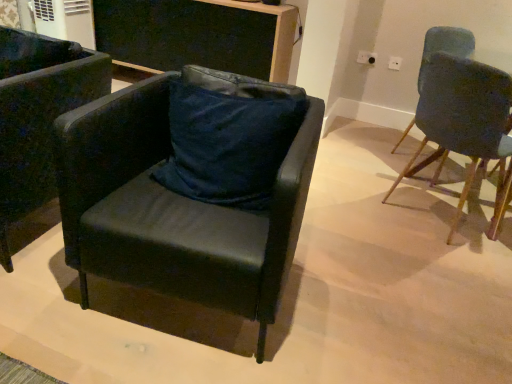
Question: Is dark blue fabric pillow at center at the left side of black leather chair at center, arranged as the 2th chair when viewed from the left?

Choices:
 (A) yes
 (B) no

Answer: (B)

Question: Is dark blue fabric pillow at center facing towards black leather chair at center, arranged as the 2th chair when viewed from the left?

Choices:
 (A) yes
 (B) no

Answer: (A)

Question: Is dark blue fabric pillow at center completely or partially outside of black leather chair at center, which is the 2th chair in right-to-left order?

Choices:
 (A) no
 (B) yes

Answer: (A)

Question: Does dark blue fabric pillow at center have a lesser width compared to black leather chair at center, which is the 2th chair in right-to-left order?

Choices:
 (A) no
 (B) yes

Answer: (B)

Question: Is dark blue fabric pillow at center touching black leather chair at center, arranged as the 2th chair when viewed from the left?

Choices:
 (A) yes
 (B) no

Answer: (B)

Question: Visually, is black leather chair at center, which is the 2th chair in right-to-left order, positioned to the left or to the right of black leather chair at left, acting as the 3th chair starting from the right?

Choices:
 (A) left
 (B) right

Answer: (B)

Question: From a real-world perspective, is black leather chair at center, arranged as the 2th chair when viewed from the left, positioned above or below black leather chair at left, which ranks as the first chair in left-to-right order?

Choices:
 (A) below
 (B) above

Answer: (A)

Question: Is black leather chair at center, arranged as the 2th chair when viewed from the left, inside the boundaries of black leather chair at left, which ranks as the first chair in left-to-right order, or outside?

Choices:
 (A) outside
 (B) inside

Answer: (A)

Question: From the image's perspective, relative to black leather chair at left, which ranks as the first chair in left-to-right order, is black leather chair at center, arranged as the 2th chair when viewed from the left, above or below?

Choices:
 (A) below
 (B) above

Answer: (A)

Question: In terms of height, does black leather chair at left, acting as the 3th chair starting from the right, look taller or shorter compared to white plastic power outlet at upper right, the 2th power outlet viewed from the left?

Choices:
 (A) tall
 (B) short

Answer: (A)

Question: From a real-world perspective, relative to white plastic power outlet at upper right, which appears as the 1th power outlet when viewed from the right, is black leather chair at left, acting as the 3th chair starting from the right, vertically above or below?

Choices:
 (A) above
 (B) below

Answer: (B)

Question: From the image's perspective, is black leather chair at left, acting as the 3th chair starting from the right, above or below white plastic power outlet at upper right, the 2th power outlet viewed from the left?

Choices:
 (A) above
 (B) below

Answer: (B)

Question: Is black leather chair at left, which ranks as the first chair in left-to-right order, wider or thinner than white plastic power outlet at upper right, which appears as the 1th power outlet when viewed from the right?

Choices:
 (A) thin
 (B) wide

Answer: (B)

Question: Considering the positions of white plastic power outlet at upper center, acting as the second power outlet starting from the right, and velvet dark blue chair at right, placed as the 1th chair when sorted from right to left, in the image, is white plastic power outlet at upper center, acting as the second power outlet starting from the right, wider or thinner than velvet dark blue chair at right, placed as the 1th chair when sorted from right to left,?

Choices:
 (A) wide
 (B) thin

Answer: (B)

Question: Is white plastic power outlet at upper center, which is the 1th power outlet in left-to-right order, taller or shorter than velvet dark blue chair at right, acting as the third chair starting from the left?

Choices:
 (A) tall
 (B) short

Answer: (B)